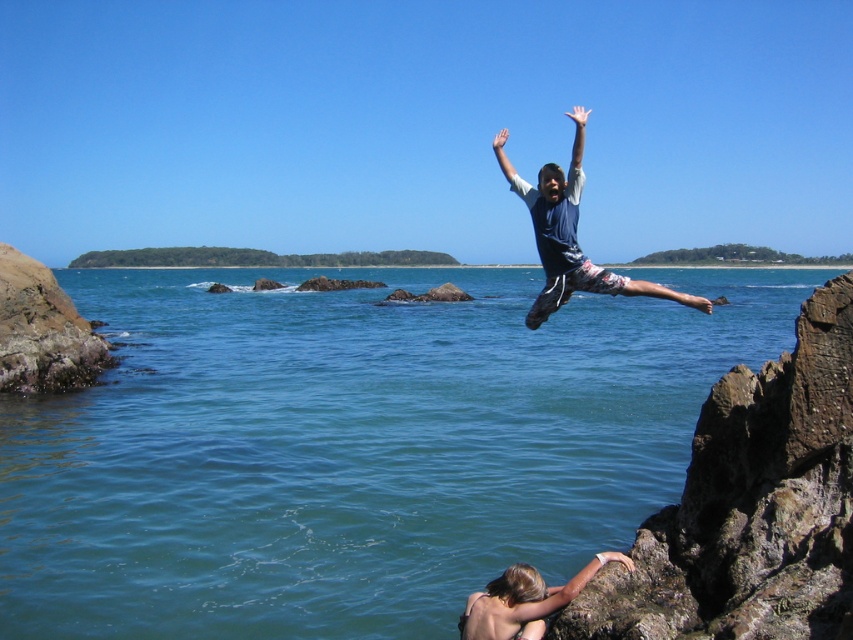
From the picture: You are a photographer standing at the edge of the rocky outcrop. You want to capture the perfect shot of the person jumping into the water. Where should you position your camera to ensure the point at point (352,445) is in the center of your photo?

You should position your camera at the edge of the rocky outcrop facing the clear blue water at center where the point (352,445) is located, ensuring it is centered in your frame.

You are a photographer positioned at the edge of the cliff, aiming to capture the person jumping into the water. You notice the blue cotton shirt at upper center and the blonde hair at lower right. Which object should you focus on first to ensure both are in sharp focus?

You should focus on the blue cotton shirt at upper center first because it is closer to you than the blonde hair at lower right, so focusing on the closer object will help ensure both are in sharp focus.